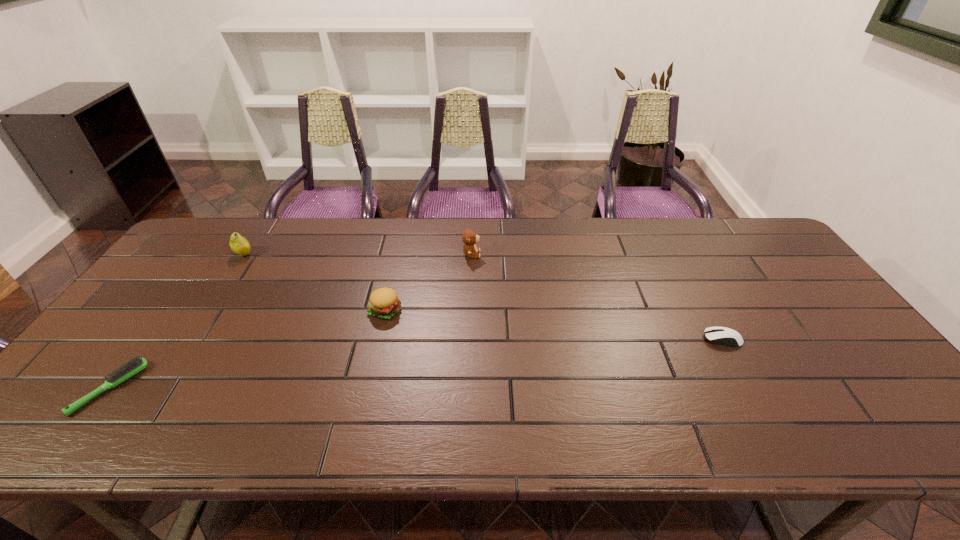
Where is `pear`? The width and height of the screenshot is (960, 540). pear is located at coordinates (238, 244).

This screenshot has height=540, width=960. I want to click on teddy bear, so click(x=470, y=238).

I want to click on the third tallest object, so click(x=384, y=303).

The image size is (960, 540). Find the location of `hamburger`. hamburger is located at coordinates (384, 303).

Where is `the fourth farthest object`? This screenshot has height=540, width=960. the fourth farthest object is located at coordinates (716, 335).

At what (x,y) coordinates should I click in order to perform the action: click on the rightmost object. Please return your answer as a coordinate pair (x, y). Looking at the image, I should click on [x=716, y=335].

Where is `hairbrush`? The width and height of the screenshot is (960, 540). hairbrush is located at coordinates (136, 365).

This screenshot has height=540, width=960. I want to click on the nearest object, so click(136, 365).

You are a GUI agent. You are given a task and a screenshot of the screen. Output one action in this format:
    pyautogui.click(x=<x>, y=<y>)
    Task: Click on the free spot located 0.400m on the right of the pear
    The width and height of the screenshot is (960, 540).
    Given the screenshot: What is the action you would take?
    pyautogui.click(x=379, y=254)

Where is `free space located 0.150m on the face of the fourth object from left to right`? This screenshot has height=540, width=960. free space located 0.150m on the face of the fourth object from left to right is located at coordinates (528, 254).